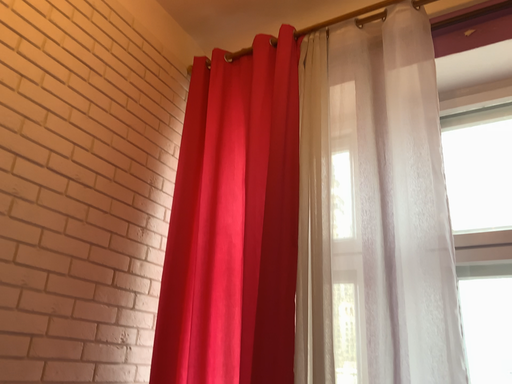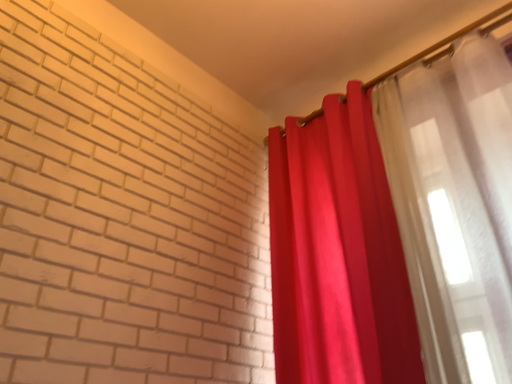
Question: Which way did the camera rotate in the video?

Choices:
 (A) rotated right
 (B) rotated left

Answer: (B)